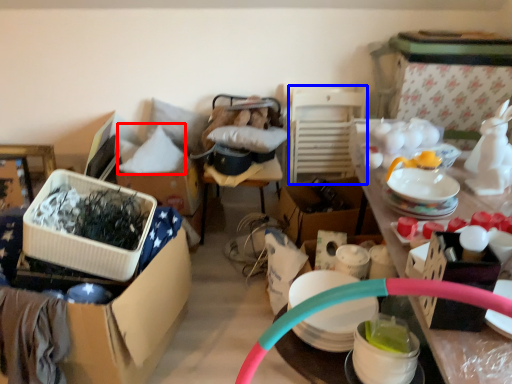
Question: Among these objects, which one is farthest to the camera, pillow (highlighted by a red box) or chair (highlighted by a blue box)?

Choices:
 (A) pillow
 (B) chair

Answer: (B)